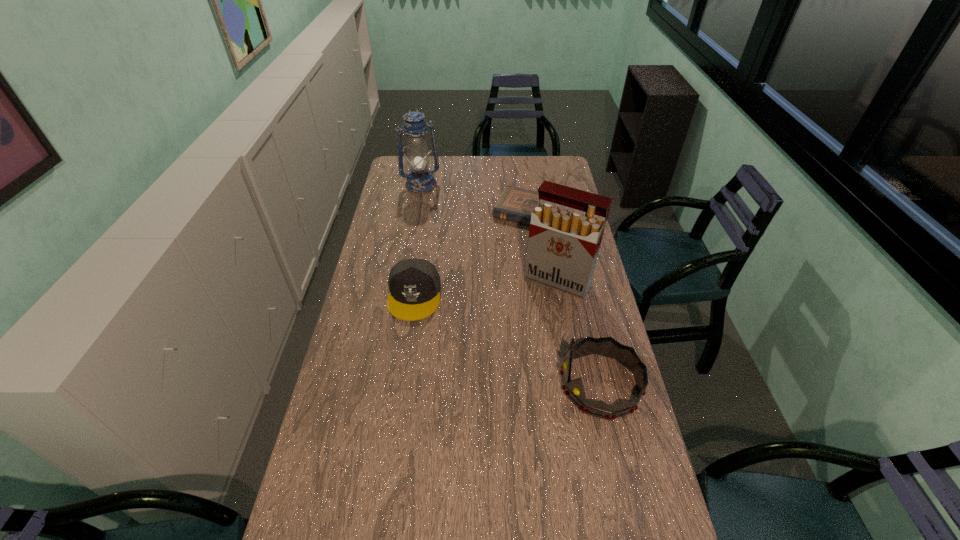
Find the location of a particular element. vacant space located 0.240m at the front of the tiara with jewels is located at coordinates (480, 384).

In order to click on free space located 0.230m with the lid open on the cigarette case in this screenshot , I will do `click(519, 342)`.

Where is `free space located with the lid open on the cigarette case`? The image size is (960, 540). free space located with the lid open on the cigarette case is located at coordinates (513, 354).

In order to click on free space located 0.190m with the lid open on the cigarette case in this screenshot , I will do `click(524, 334)`.

Image resolution: width=960 pixels, height=540 pixels. In order to click on vacant region located on the front-facing side of the lantern in this screenshot , I will do `click(438, 217)`.

This screenshot has width=960, height=540. In order to click on blank space located on the front-facing side of the lantern in this screenshot , I will do `click(434, 210)`.

The height and width of the screenshot is (540, 960). What are the coordinates of `vacant space located on the front-facing side of the lantern` in the screenshot? It's located at (438, 216).

Locate an element on the screen. This screenshot has width=960, height=540. vacant space located on the spine side of the shortest object is located at coordinates (504, 267).

What are the coordinates of `free space located 0.360m on the spine side of the shortest object` in the screenshot? It's located at (492, 290).

Locate an element on the screen. The image size is (960, 540). vacant space situated 0.330m on the spine side of the shortest object is located at coordinates [495, 285].